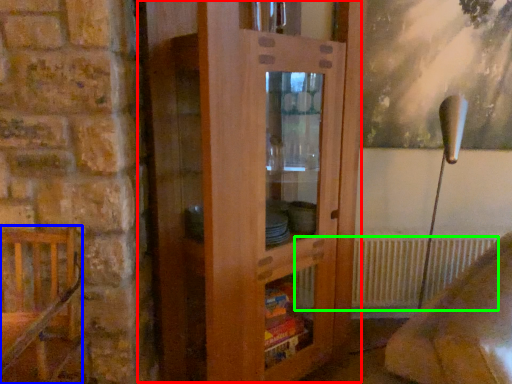
Question: Which object is positioned closest to dresser (highlighted by a red box)? Select from furniture (highlighted by a blue box) and radiator (highlighted by a green box).

Choices:
 (A) furniture
 (B) radiator

Answer: (A)